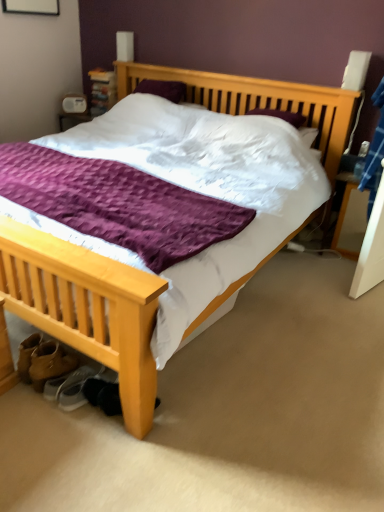
Question: Relative to leather tan boot at lower left, is light wood bed at center in front or behind?

Choices:
 (A) front
 (B) behind

Answer: (A)

Question: In terms of size, does light wood bed at center appear bigger or smaller than leather tan boot at lower left?

Choices:
 (A) small
 (B) big

Answer: (B)

Question: Which of these objects is positioned farthest from the white fabric shoe at lower left, which ranks as the 1th shoe in left-to-right order?

Choices:
 (A) light wood bed at center
 (B) leather tan boot at lower left
 (C) wooden nightstand at right
 (D) black suede shoe at lower left, which appears as the second shoe when viewed from the left

Answer: (A)

Question: Based on their relative distances, which object is farther from the light wood bed at center?

Choices:
 (A) white fabric shoe at lower left, arranged as the 2th shoe when viewed from the right
 (B) black suede shoe at lower left, which appears as the second shoe when viewed from the left
 (C) wooden nightstand at right
 (D) leather tan boot at lower left

Answer: (A)